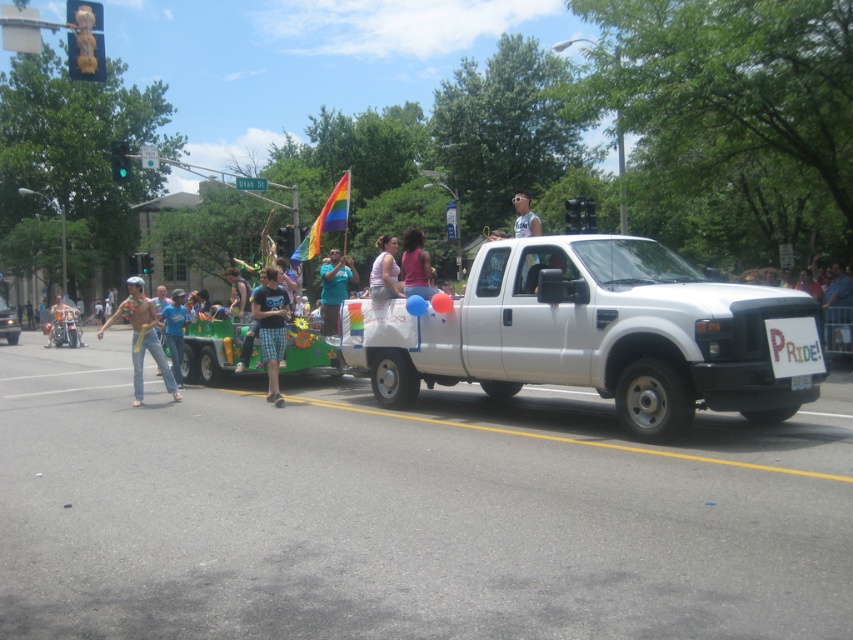
Between pink fabric shirt at center and matte purple shirt at center, which one has less height?

matte purple shirt at center is shorter.

Who is positioned more to the left, pink fabric shirt at center or matte purple shirt at center?

matte purple shirt at center

What do you see at coordinates (415, 264) in the screenshot? I see `pink fabric shirt at center` at bounding box center [415, 264].

Identify the location of pink fabric shirt at center. The image size is (853, 640). (415, 264).

Between plaid shorts at center and blue shirt at center, which one appears on the right side from the viewer's perspective?

plaid shorts at center

Looking at this image, can you confirm if plaid shorts at center is shorter than blue shirt at center?

Yes, plaid shorts at center is shorter than blue shirt at center.

Describe the element at coordinates (271, 326) in the screenshot. This screenshot has width=853, height=640. I see `plaid shorts at center` at that location.

You are a GUI agent. You are given a task and a screenshot of the screen. Output one action in this format:
    pyautogui.click(x=<x>, y=<y>)
    Task: Click on the plaid shorts at center
    Image resolution: width=853 pixels, height=640 pixels.
    Given the screenshot: What is the action you would take?
    pyautogui.click(x=271, y=326)

Who is positioned more to the right, denim jeans at left or rainbow fabric flag at upper center?

rainbow fabric flag at upper center

Is point (173, 385) less distant than point (311, 256)?

Yes, it is in front of point (311, 256).

Is point (125, 314) farther from viewer compared to point (318, 250)?

No, it is not.

Identify the location of denim jeans at left. (142, 337).